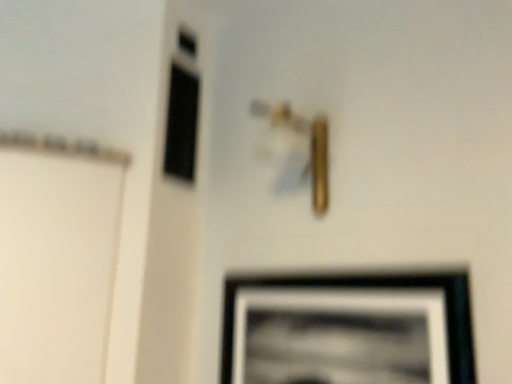
Question: Can you confirm if gold metallic door handle at center is positioned to the left of black glass window at upper left?

Choices:
 (A) no
 (B) yes

Answer: (A)

Question: Does gold metallic door handle at center contain black glass window at upper left?

Choices:
 (A) yes
 (B) no

Answer: (B)

Question: Can you confirm if gold metallic door handle at center is bigger than black glass window at upper left?

Choices:
 (A) yes
 (B) no

Answer: (A)

Question: Is gold metallic door handle at center turned away from black glass window at upper left?

Choices:
 (A) yes
 (B) no

Answer: (B)

Question: Is gold metallic door handle at center wider than black glass window at upper left?

Choices:
 (A) yes
 (B) no

Answer: (A)

Question: Is gold metallic door handle at center aimed at black glass window at upper left?

Choices:
 (A) no
 (B) yes

Answer: (A)

Question: From the image's perspective, would you say gold metallic door handle at center is positioned over black matte picture frame at lower right?

Choices:
 (A) yes
 (B) no

Answer: (A)

Question: Is gold metallic door handle at center far from black matte picture frame at lower right?

Choices:
 (A) yes
 (B) no

Answer: (B)

Question: Is black matte picture frame at lower right at the back of gold metallic door handle at center?

Choices:
 (A) no
 (B) yes

Answer: (A)

Question: Is the surface of gold metallic door handle at center in direct contact with black matte picture frame at lower right?

Choices:
 (A) yes
 (B) no

Answer: (B)

Question: Considering the relative sizes of gold metallic door handle at center and black matte picture frame at lower right in the image provided, is gold metallic door handle at center shorter than black matte picture frame at lower right?

Choices:
 (A) yes
 (B) no

Answer: (A)

Question: Considering the relative positions of gold metallic door handle at center and black matte picture frame at lower right in the image provided, is gold metallic door handle at center behind black matte picture frame at lower right?

Choices:
 (A) yes
 (B) no

Answer: (A)

Question: From the image's perspective, does black glass window at upper left appear lower than gold metallic door handle at center?

Choices:
 (A) no
 (B) yes

Answer: (A)